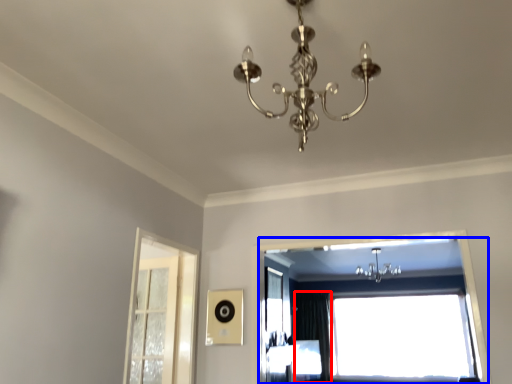
Question: Which point is closer to the camera, curtain (highlighted by a red box) or window (highlighted by a blue box)?

Choices:
 (A) curtain
 (B) window

Answer: (B)